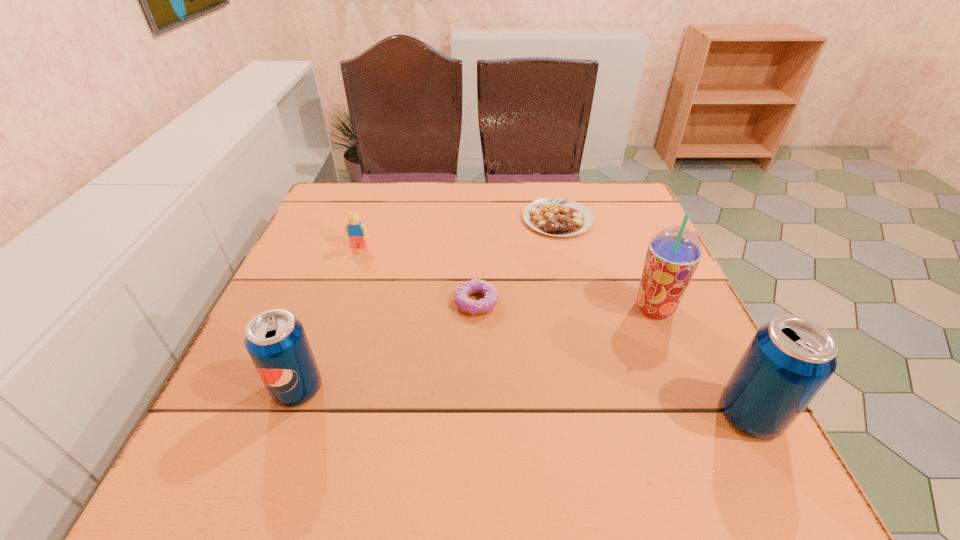
In the image, there is a desktop. Identify the location of free region at the near right corner. This screenshot has height=540, width=960. (716, 424).

The width and height of the screenshot is (960, 540). In order to click on vacant area between the second tallest object and the second farthest object in this screenshot , I will do `click(555, 330)`.

Image resolution: width=960 pixels, height=540 pixels. What are the coordinates of `empty location between the third tallest object and the doughnut` in the screenshot? It's located at (387, 346).

The width and height of the screenshot is (960, 540). What are the coordinates of `vacant area between the third object from right to left and the tallest object` in the screenshot? It's located at (606, 264).

Image resolution: width=960 pixels, height=540 pixels. Find the location of `unoccupied area between the Lego and the doughnut`. unoccupied area between the Lego and the doughnut is located at coordinates (418, 275).

The image size is (960, 540). In order to click on free spot between the fourth object from left to right and the fourth object from right to left in this screenshot , I will do `click(516, 261)`.

Where is `free space between the doughnut and the steak`? The image size is (960, 540). free space between the doughnut and the steak is located at coordinates (516, 261).

Locate an element on the screen. Image resolution: width=960 pixels, height=540 pixels. empty location between the taller pop soda and the doughnut is located at coordinates (613, 359).

Identify the location of free space that is in between the right pop soda and the Lego. (555, 330).

The height and width of the screenshot is (540, 960). I want to click on free area in between the steak and the left pop soda, so click(427, 304).